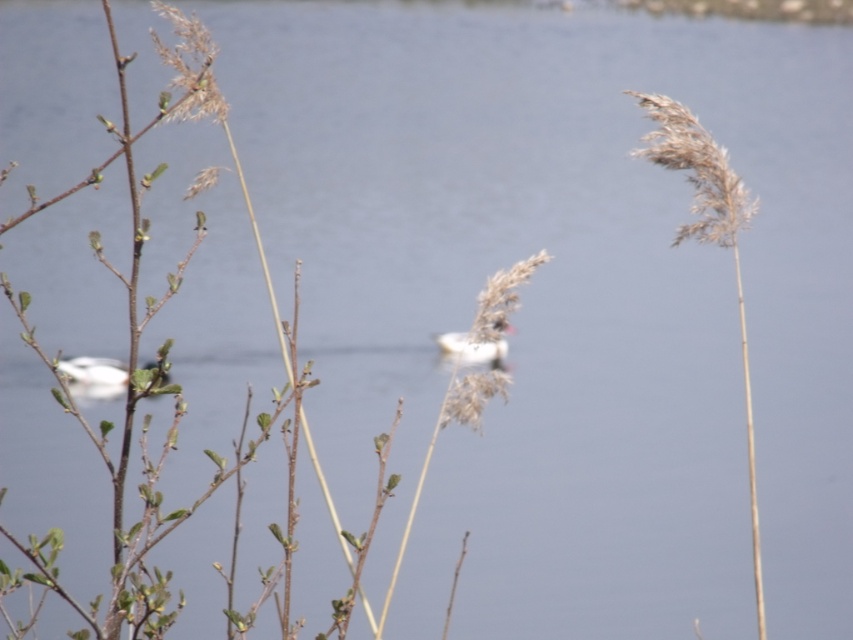
Question: Is white matte boat at left wider than white fluffy bird at center?

Choices:
 (A) yes
 (B) no

Answer: (A)

Question: Which point is farther from the camera taking this photo?

Choices:
 (A) (497, 353)
 (B) (166, 380)

Answer: (A)

Question: Which of the following is the closest to the observer?

Choices:
 (A) (100, 380)
 (B) (473, 362)

Answer: (B)

Question: Is white matte boat at left thinner than white fluffy bird at center?

Choices:
 (A) yes
 (B) no

Answer: (B)

Question: Is white matte boat at left to the left of white fluffy bird at center from the viewer's perspective?

Choices:
 (A) yes
 (B) no

Answer: (A)